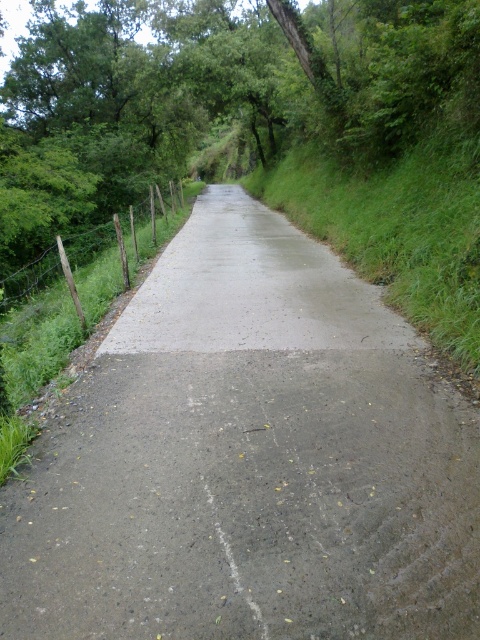
Question: Among these objects, which one is farthest from the camera?

Choices:
 (A) gray concrete road at center
 (B) green wire fence at left

Answer: (B)

Question: Is gray concrete road at center behind green wire fence at left?

Choices:
 (A) no
 (B) yes

Answer: (A)

Question: Is gray concrete road at center positioned at the back of green wire fence at left?

Choices:
 (A) no
 (B) yes

Answer: (A)

Question: Is gray concrete road at center thinner than green wire fence at left?

Choices:
 (A) yes
 (B) no

Answer: (A)

Question: Among these points, which one is farthest from the camera?

Choices:
 (A) (0, 321)
 (B) (15, 486)

Answer: (A)